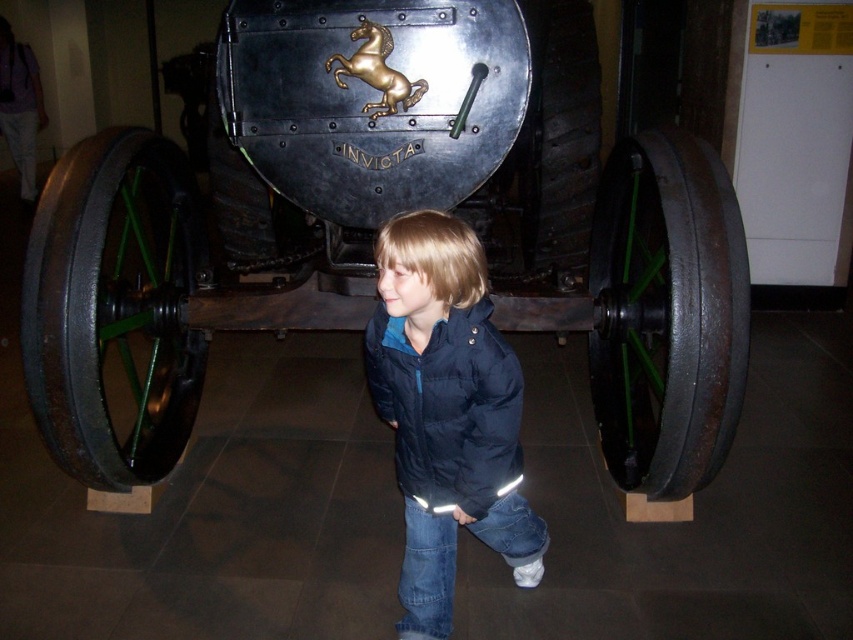
You are a museum guide explaining the exhibit to a visitor. The visitor asks why the polished metal cannon at center is positioned so high compared to the navy blue jacket at center. What do you explain?

The polished metal cannon at center is located above the navy blue jacket at center, which emphasizes the cannon as a central feature of the exhibit, drawing attention to its historical significance and design.

You are a museum visitor who wants to take a photo of the polished metal cannon at center and the navy blue jacket at center. To ensure both are in the frame, which object should you position closer to the camera?

The polished metal cannon at center is positioned on the left side of navy blue jacket at center. To include both in the photo, position the camera so that the navy blue jacket at center is closer to the camera, as the cannon is already to its left and this arrangement will keep both within the frame.